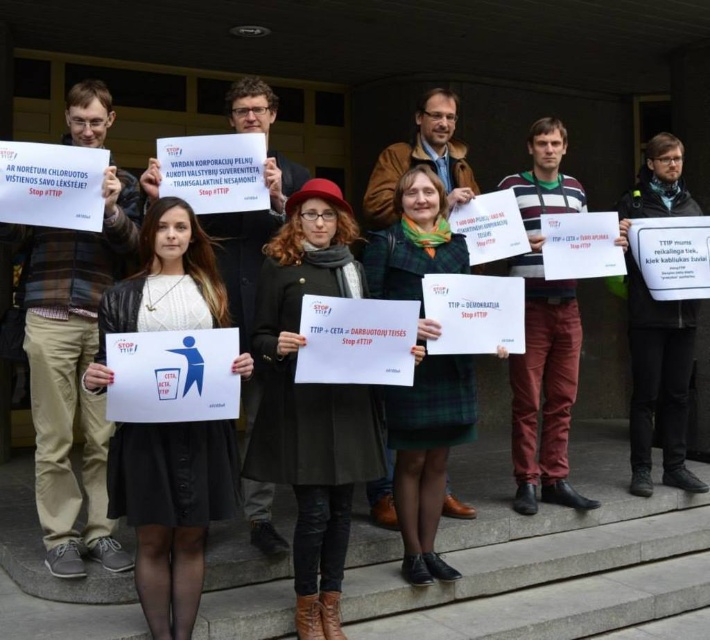
In the scene where nine people are protesting against TTIP and CETA on concrete steps, you notice two sweaters among their clothing. The striped sweater at center and the green woolen sweater at center. Which sweater takes up more visual space in the image?

The striped sweater at center is larger in size than the green woolen sweater at center, so the striped sweater at center takes up more visual space in the image.